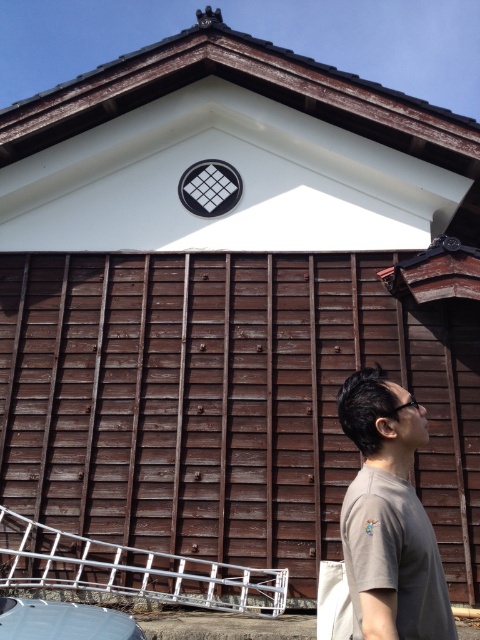
Question: Observing the image, what is the correct spatial positioning of brown matte t-shirt at lower right in reference to metallic silver car at lower left?

Choices:
 (A) left
 (B) right

Answer: (B)

Question: Among these objects, which one is farthest from the camera?

Choices:
 (A) brown matte t-shirt at lower right
 (B) metallic silver car at lower left

Answer: (B)

Question: Which of the following is the farthest from the observer?

Choices:
 (A) (393, 605)
 (B) (0, 600)

Answer: (B)

Question: In this image, where is brown matte t-shirt at lower right located relative to metallic silver car at lower left?

Choices:
 (A) below
 (B) above

Answer: (B)

Question: Is brown matte t-shirt at lower right wider than metallic silver car at lower left?

Choices:
 (A) yes
 (B) no

Answer: (B)